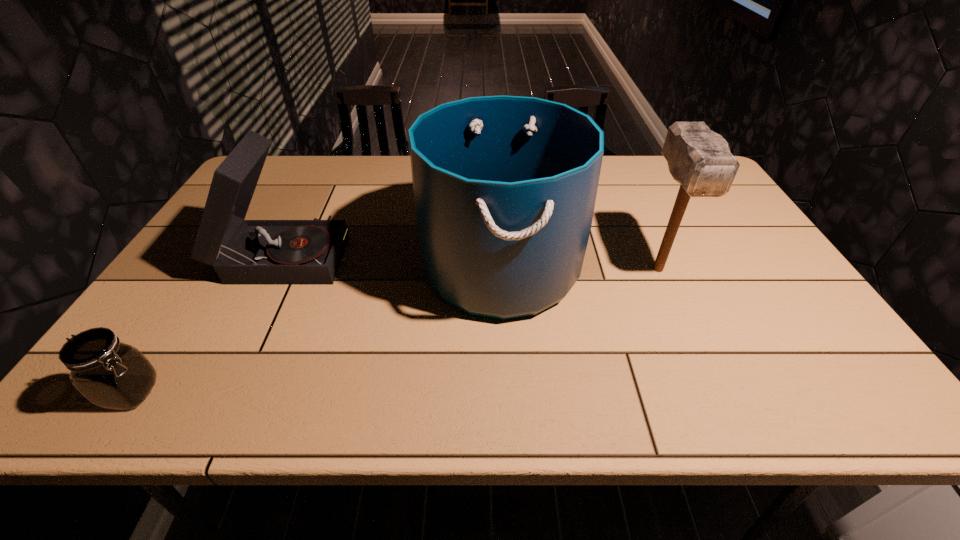
In order to click on free space between the phonograph_record and the jar in this screenshot , I will do `click(208, 323)`.

You are a GUI agent. You are given a task and a screenshot of the screen. Output one action in this format:
    pyautogui.click(x=<x>, y=<y>)
    Task: Click on the vacant point located between the nearest object and the phonograph_record
    
    Given the screenshot: What is the action you would take?
    pyautogui.click(x=208, y=323)

Find the location of `vacant space that is in between the bucket and the phonograph_record`. vacant space that is in between the bucket and the phonograph_record is located at coordinates (393, 260).

Where is `vacant space that is in between the jar and the bucket`? vacant space that is in between the jar and the bucket is located at coordinates (316, 329).

In order to click on vacant point located between the second object from right to left and the jar in this screenshot , I will do `click(316, 329)`.

Select which object is the closest to the phonograph_record. Please provide its 2D coordinates. Your answer should be formatted as a tuple, i.e. [(x, y)], where the tuple contains the x and y coordinates of a point satisfying the conditions above.

[(504, 187)]

Find the location of a particular element. the third closest object to the shortest object is located at coordinates click(699, 159).

Locate an element on the screen. Image resolution: width=960 pixels, height=540 pixels. blank area in the image that satisfies the following two spatial constraints: 1. on the striking face of the mallet; 2. on the lid of the shortest object is located at coordinates (713, 393).

Find the location of a particular element. This screenshot has width=960, height=540. free space that satisfies the following two spatial constraints: 1. on the back side of the bucket; 2. on the front-facing side of the phonograph_record is located at coordinates (500, 254).

Identify the location of free point that satisfies the following two spatial constraints: 1. on the front side of the second object from right to left; 2. on the lid of the shortest object. Image resolution: width=960 pixels, height=540 pixels. (507, 393).